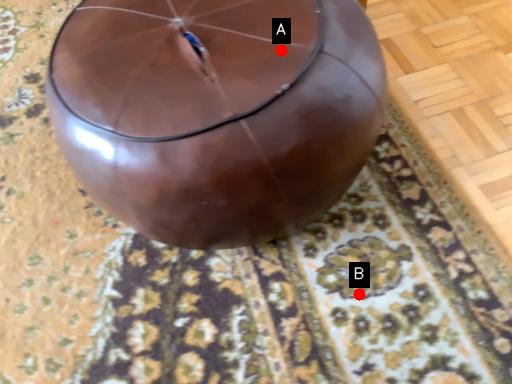
Question: Two points are circled on the image, labeled by A and B beside each circle. Which point is closer to the camera?

Choices:
 (A) A is closer
 (B) B is closer

Answer: (A)